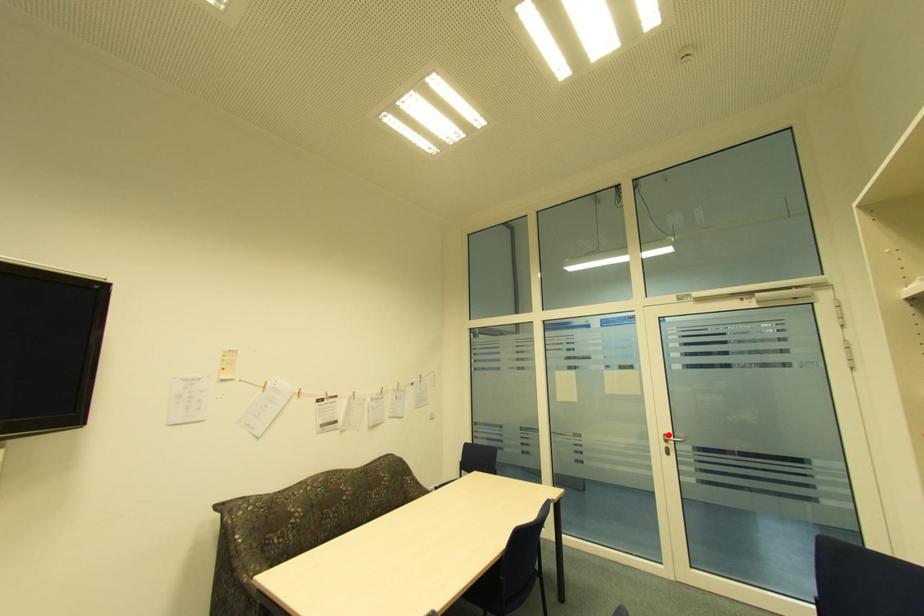
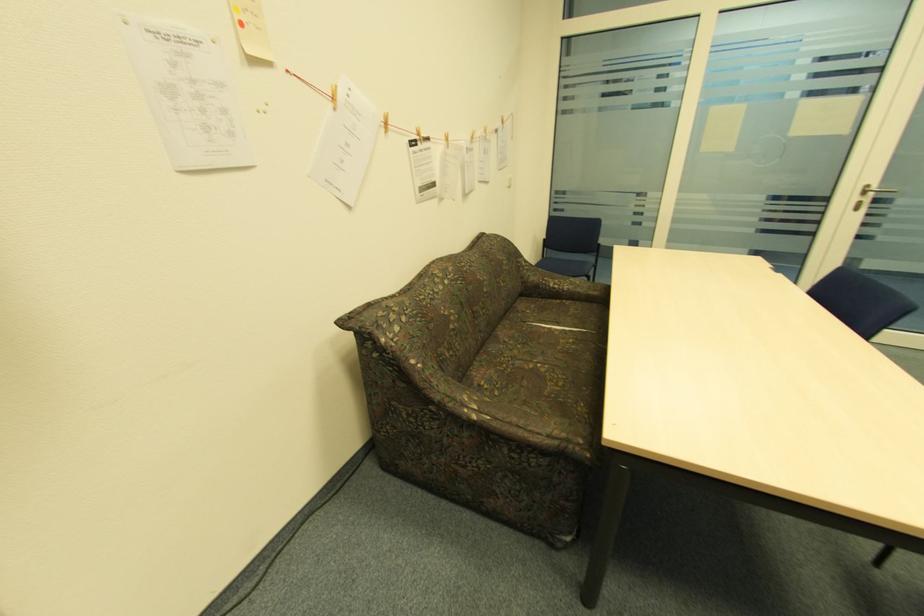
Locate, in the second image, the point that corresponds to the highlighted location in the first image.

(870, 187)